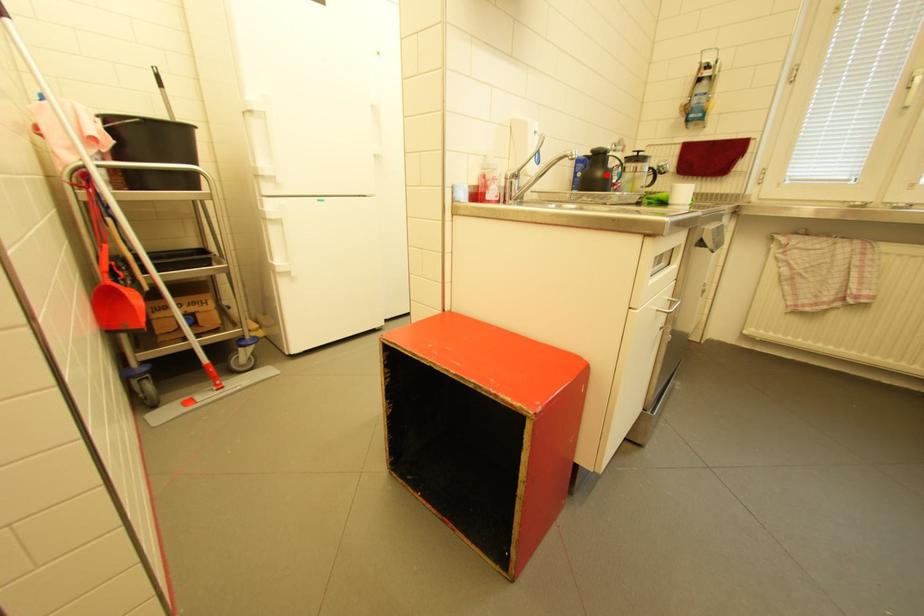
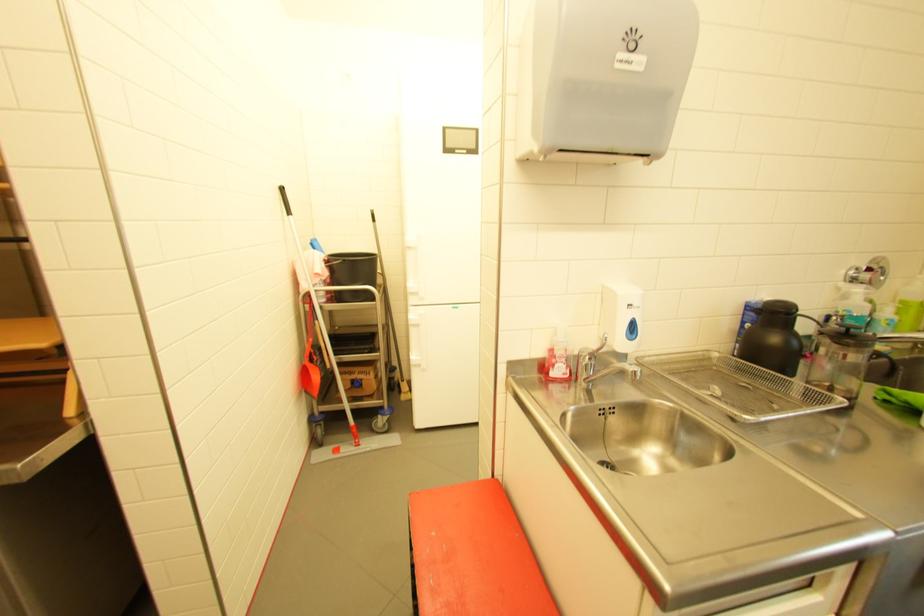
Find the pixel in the second image that matches the highlighted location in the first image.

(782, 339)